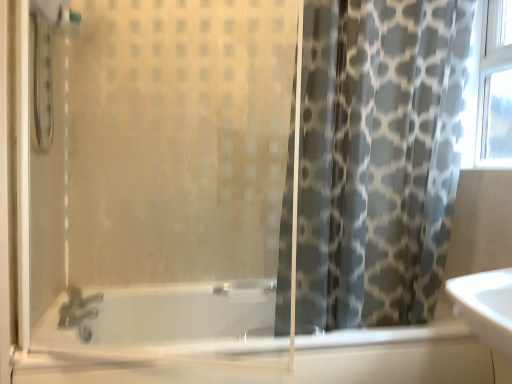
Question: Considering the relative sizes of gray fabric curtain at right and translucent glass bathtub at lower center in the image provided, is gray fabric curtain at right bigger than translucent glass bathtub at lower center?

Choices:
 (A) yes
 (B) no

Answer: (B)

Question: Is gray fabric curtain at right positioned with its back to translucent glass bathtub at lower center?

Choices:
 (A) yes
 (B) no

Answer: (B)

Question: From a real-world perspective, is gray fabric curtain at right on translucent glass bathtub at lower center?

Choices:
 (A) yes
 (B) no

Answer: (A)

Question: Are gray fabric curtain at right and translucent glass bathtub at lower center located far from each other?

Choices:
 (A) no
 (B) yes

Answer: (A)

Question: Is gray fabric curtain at right shorter than translucent glass bathtub at lower center?

Choices:
 (A) yes
 (B) no

Answer: (B)

Question: From the image's perspective, is gray fabric curtain at right located above or below transparent glass shower door at left?

Choices:
 (A) below
 (B) above

Answer: (B)

Question: From their relative heights in the image, would you say gray fabric curtain at right is taller or shorter than transparent glass shower door at left?

Choices:
 (A) tall
 (B) short

Answer: (A)

Question: Considering the positions of gray fabric curtain at right and transparent glass shower door at left in the image, is gray fabric curtain at right wider or thinner than transparent glass shower door at left?

Choices:
 (A) thin
 (B) wide

Answer: (B)

Question: Is gray fabric curtain at right in front of or behind transparent glass shower door at left in the image?

Choices:
 (A) front
 (B) behind

Answer: (B)

Question: In the image, is gray fabric curtain at right positioned in front of or behind translucent glass bathtub at lower center?

Choices:
 (A) behind
 (B) front

Answer: (A)

Question: Is gray fabric curtain at right wider or thinner than translucent glass bathtub at lower center?

Choices:
 (A) thin
 (B) wide

Answer: (A)

Question: Considering the relative positions of gray fabric curtain at right and translucent glass bathtub at lower center in the image provided, is gray fabric curtain at right to the left or to the right of translucent glass bathtub at lower center?

Choices:
 (A) left
 (B) right

Answer: (B)

Question: Is gray fabric curtain at right taller or shorter than translucent glass bathtub at lower center?

Choices:
 (A) tall
 (B) short

Answer: (A)

Question: In terms of size, does transparent glass shower door at left appear bigger or smaller than gray fabric curtain at right?

Choices:
 (A) small
 (B) big

Answer: (A)

Question: From the image's perspective, is transparent glass shower door at left positioned above or below gray fabric curtain at right?

Choices:
 (A) below
 (B) above

Answer: (A)